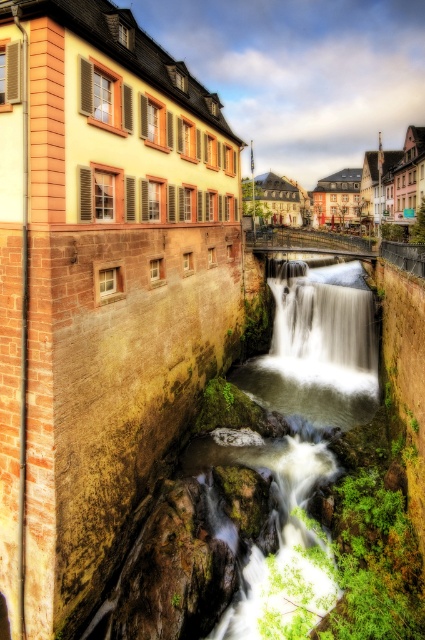
Question: Can you confirm if pastel painted buildings at center is wider than white frothy water at center?

Choices:
 (A) yes
 (B) no

Answer: (A)

Question: Does pastel painted buildings at center have a greater width compared to white frothy water at center?

Choices:
 (A) no
 (B) yes

Answer: (B)

Question: Can you confirm if pastel painted buildings at center is positioned above white frothy water at center?

Choices:
 (A) yes
 (B) no

Answer: (A)

Question: Which point is farther to the camera?

Choices:
 (A) (360, 339)
 (B) (325, 208)

Answer: (B)

Question: Which of the following is the farthest from the observer?

Choices:
 (A) pastel painted buildings at center
 (B) white frothy water at center

Answer: (A)